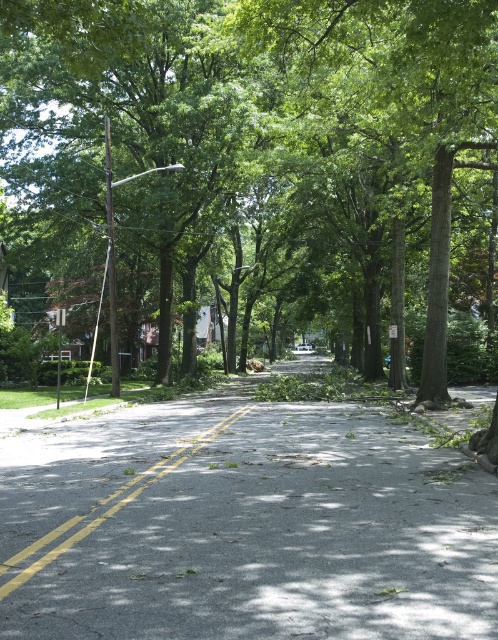
You are standing on the residential street and want to take a photo of the green leafy tree at center. If your camera can focus on objects up to 10 meters away, will you be able to capture a clear image?

The green leafy tree at center is 11.08 meters from viewer, which is beyond the camera focus range of 10 meters. Therefore, the camera cannot capture a clear image of the green leafy tree at center.

You are a delivery person with a 6 feet wide delivery truck. You need to drive through the residential street shown in the image. The truck requires a minimum clearance of 50 feet between the green leafy tree at center and dark gray asphalt road at center to safely pass. Can your truck navigate this section of the road?

The green leafy tree at center and dark gray asphalt road at center are 50.46 feet apart. Since the truck requires a minimum clearance of 50 feet, the 50.46 feet distance is sufficient, so yes, the truck can safely navigate this section of the road.

Based on the photo, you are a delivery driver who needs to navigate through the residential street. Considering the green leafy tree at center and the dark gray asphalt road at center, which one would you need to avoid hitting with your vehicle?

The green leafy tree at center has a larger size compared to the dark gray asphalt road at center, so you should avoid hitting the green leafy tree at center to prevent damage to your vehicle and ensure safe passage.